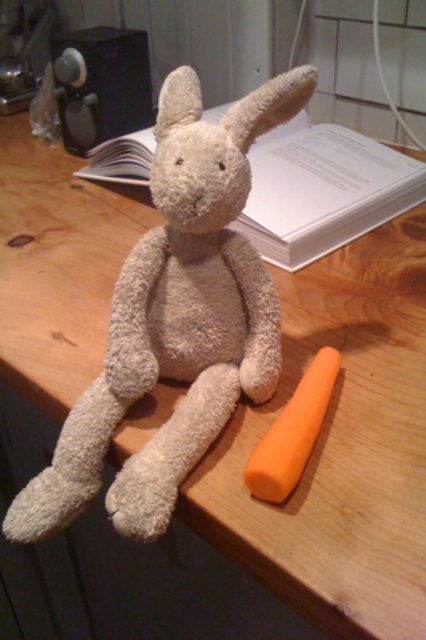
Question: Which point is closer to the camera?

Choices:
 (A) (310, 417)
 (B) (278, 148)

Answer: (A)

Question: Can you confirm if white paper at upper center is smaller than orange matte carrot at lower right?

Choices:
 (A) yes
 (B) no

Answer: (B)

Question: Does white paper at upper center have a greater width compared to orange matte carrot at lower right?

Choices:
 (A) no
 (B) yes

Answer: (B)

Question: From the image, what is the correct spatial relationship of white paper at upper center in relation to orange matte carrot at lower right?

Choices:
 (A) left
 (B) right

Answer: (A)